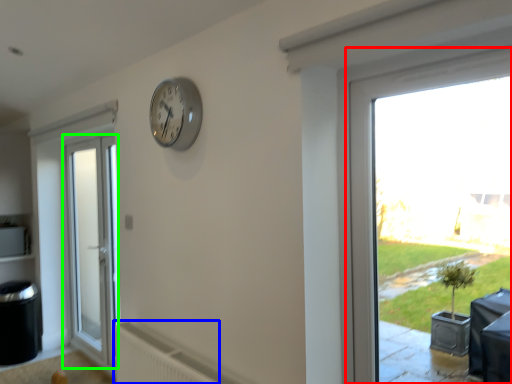
Question: Considering the real-world distances, which object is farthest from window (highlighted by a red box)? radiator (highlighted by a blue box) or door (highlighted by a green box)?

Choices:
 (A) radiator
 (B) door

Answer: (B)